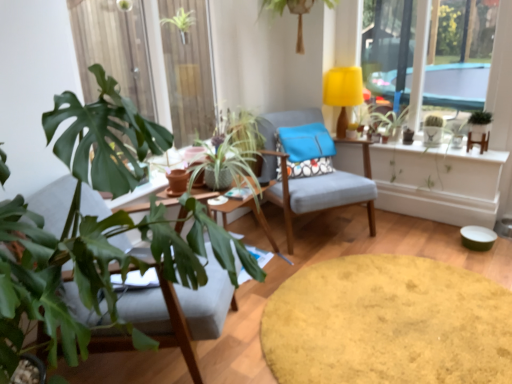
Question: From the image's perspective, would you say green leafy plant at upper center, marked as the 3th houseplant in a right-to-left arrangement, is positioned over green matte plant at upper right?

Choices:
 (A) yes
 (B) no

Answer: (A)

Question: From a real-world perspective, is green leafy plant at upper center, which appears as the third houseplant when viewed from the left, on top of green matte plant at upper right?

Choices:
 (A) yes
 (B) no

Answer: (A)

Question: Is green matte plant at upper right located within green leafy plant at upper center, marked as the 3th houseplant in a right-to-left arrangement?

Choices:
 (A) no
 (B) yes

Answer: (A)

Question: From the image's perspective, is green leafy plant at upper center, marked as the 3th houseplant in a right-to-left arrangement, under green matte plant at upper right?

Choices:
 (A) no
 (B) yes

Answer: (A)

Question: Does green leafy plant at upper center, which appears as the third houseplant when viewed from the left, have a greater height compared to green matte plant at upper right?

Choices:
 (A) yes
 (B) no

Answer: (B)

Question: Is green leafy plant at upper center, which appears as the third houseplant when viewed from the left, smaller than green matte plant at upper right?

Choices:
 (A) yes
 (B) no

Answer: (B)

Question: Is the depth of wooden round table at center, the second round table ordered from the bottom, greater than that of blue fabric pillow at center?

Choices:
 (A) no
 (B) yes

Answer: (A)

Question: Would you consider wooden round table at center, the second round table ordered from the bottom, to be distant from blue fabric pillow at center?

Choices:
 (A) no
 (B) yes

Answer: (A)

Question: Does wooden round table at center, the second round table ordered from the bottom, touch blue fabric pillow at center?

Choices:
 (A) no
 (B) yes

Answer: (A)

Question: From the image's perspective, is wooden round table at center, the second round table ordered from the bottom, located beneath blue fabric pillow at center?

Choices:
 (A) yes
 (B) no

Answer: (A)

Question: From the image's perspective, is wooden round table at center, the 1th round table in the top-to-bottom sequence, above blue fabric pillow at center?

Choices:
 (A) no
 (B) yes

Answer: (A)

Question: From a real-world perspective, is wooden round table at center, the 1th round table in the top-to-bottom sequence, below blue fabric pillow at center?

Choices:
 (A) no
 (B) yes

Answer: (B)

Question: Is wooden round table at center, the second round table ordered from the bottom, not within green leafy plant at upper center, marked as the 3th houseplant in a right-to-left arrangement?

Choices:
 (A) no
 (B) yes

Answer: (B)